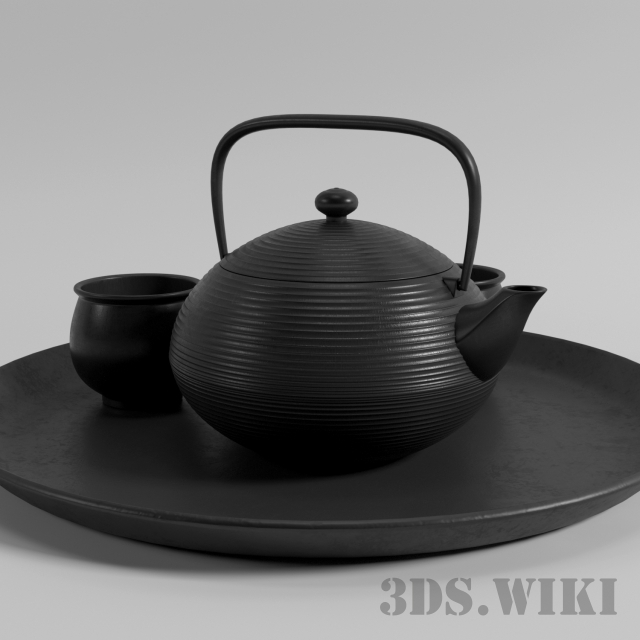
Locate an element on the screen. The width and height of the screenshot is (640, 640). cup is located at coordinates (136, 342), (488, 290).